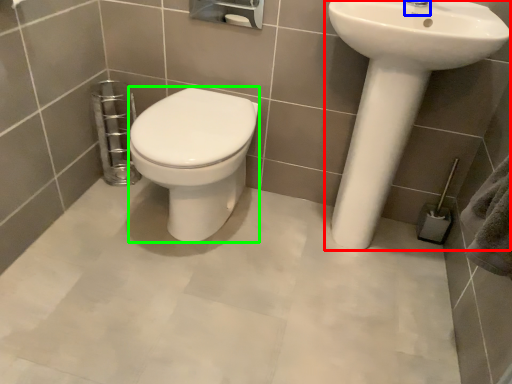
Question: Which object is positioned farthest from sink (highlighted by a red box)? Select from plumbing fixture (highlighted by a blue box) and bidet (highlighted by a green box).

Choices:
 (A) plumbing fixture
 (B) bidet

Answer: (B)